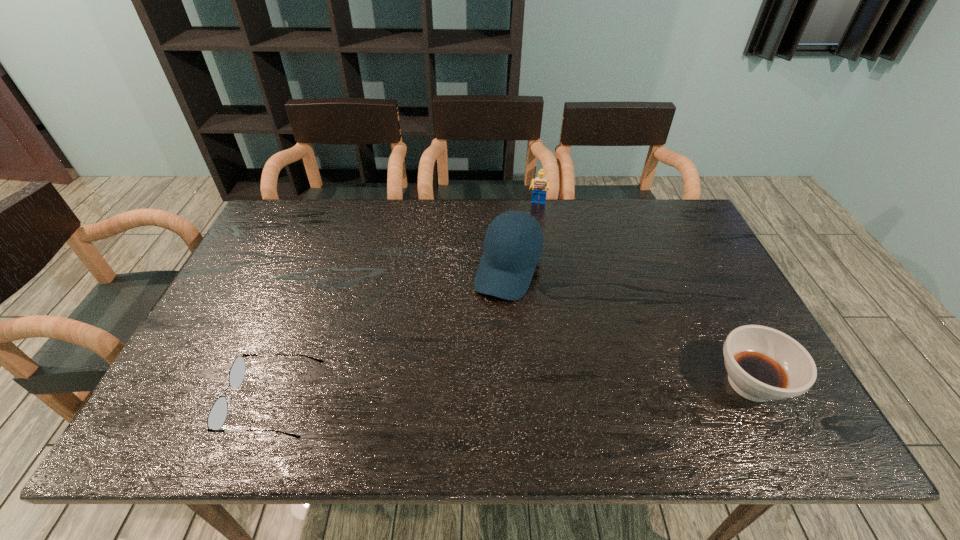
Locate which object ranks third in proximity to the third shortest object. Please provide its 2D coordinates. Your answer should be formatted as a tuple, i.e. [(x, y)], where the tuple contains the x and y coordinates of a point satisfying the conditions above.

[(218, 413)]

Find the location of `the second closest object to the rightmost object`. the second closest object to the rightmost object is located at coordinates (540, 185).